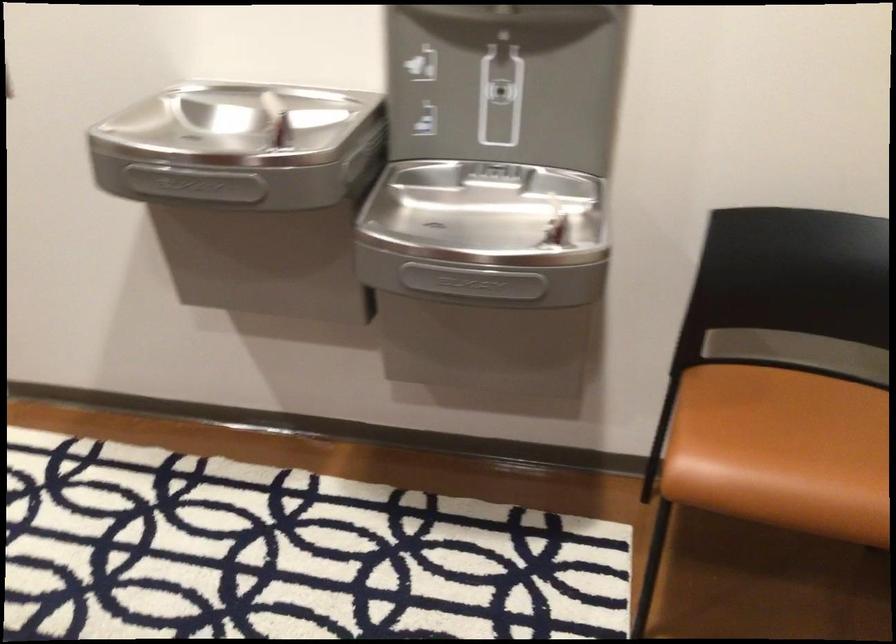
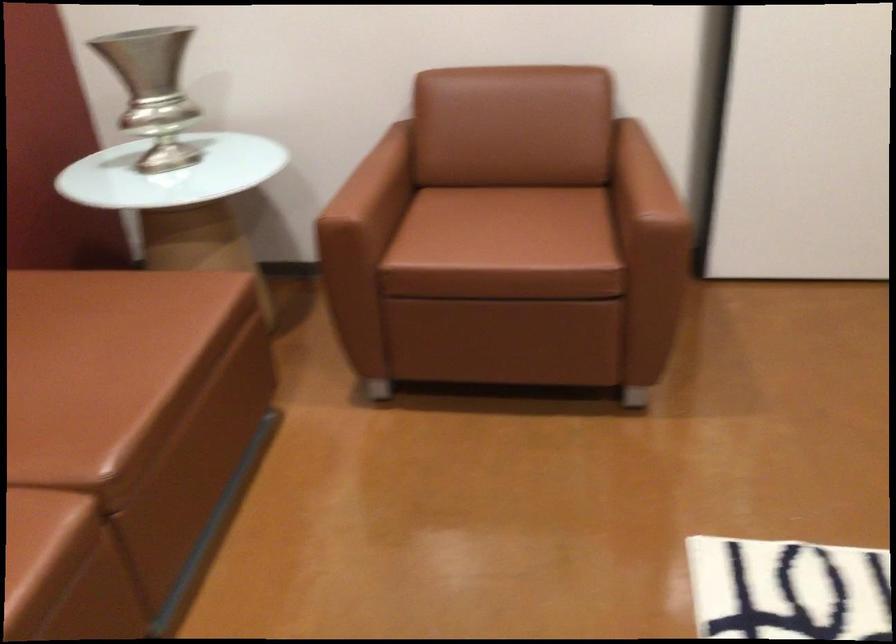
The images are taken continuously from a first-person perspective. In which direction is your viewpoint rotating?

The camera's rotation is toward left-down.